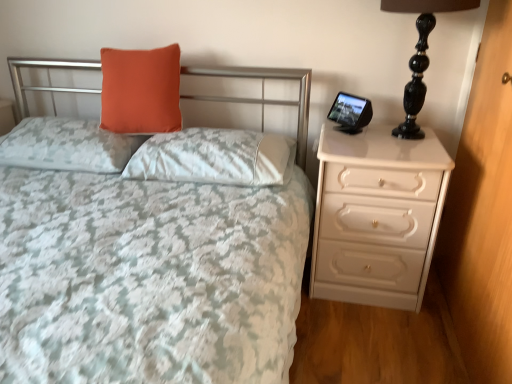
Question: Could you tell me if orange fabric pillow at upper left, acting as the first pillow starting from the left, is turned towards white satin pillow at center, the 1th pillow in the right-to-left sequence?

Choices:
 (A) yes
 (B) no

Answer: (B)

Question: Could white satin pillow at center, the 1th pillow in the right-to-left sequence, be considered to be inside orange fabric pillow at upper left, which ranks as the third pillow in right-to-left order?

Choices:
 (A) yes
 (B) no

Answer: (B)

Question: From a real-world perspective, does orange fabric pillow at upper left, which ranks as the third pillow in right-to-left order, sit lower than white satin pillow at center, the 1th pillow in the right-to-left sequence?

Choices:
 (A) yes
 (B) no

Answer: (A)

Question: From a real-world perspective, is orange fabric pillow at upper left, acting as the first pillow starting from the left, positioned over white satin pillow at center, which is the 3th pillow from left to right, based on gravity?

Choices:
 (A) yes
 (B) no

Answer: (B)

Question: Considering the relative sizes of orange fabric pillow at upper left, which ranks as the third pillow in right-to-left order, and white satin pillow at center, which is the 3th pillow from left to right, in the image provided, is orange fabric pillow at upper left, which ranks as the third pillow in right-to-left order, wider than white satin pillow at center, which is the 3th pillow from left to right,?

Choices:
 (A) no
 (B) yes

Answer: (A)

Question: Is orange fabric pillow at upper left, which ranks as the third pillow in right-to-left order, thinner than white satin pillow at center, which is the 3th pillow from left to right?

Choices:
 (A) no
 (B) yes

Answer: (B)

Question: Is white glossy dresser at right bigger than white satin pillow at center, the 1th pillow in the right-to-left sequence?

Choices:
 (A) yes
 (B) no

Answer: (A)

Question: Is white satin pillow at center, which is the 3th pillow from left to right, at the back of white glossy dresser at right?

Choices:
 (A) no
 (B) yes

Answer: (A)

Question: Is white glossy dresser at right further to the viewer compared to white satin pillow at center, which is the 3th pillow from left to right?

Choices:
 (A) yes
 (B) no

Answer: (B)

Question: Does white glossy dresser at right have a lesser width compared to white satin pillow at center, which is the 3th pillow from left to right?

Choices:
 (A) no
 (B) yes

Answer: (B)

Question: Can you confirm if white glossy dresser at right is wider than white satin pillow at center, the 1th pillow in the right-to-left sequence?

Choices:
 (A) no
 (B) yes

Answer: (A)

Question: Does white glossy dresser at right appear on the right side of white satin pillow at center, which is the 3th pillow from left to right?

Choices:
 (A) no
 (B) yes

Answer: (B)

Question: Is matte white bedspread at center looking in the opposite direction of white glossy dresser at right?

Choices:
 (A) no
 (B) yes

Answer: (A)